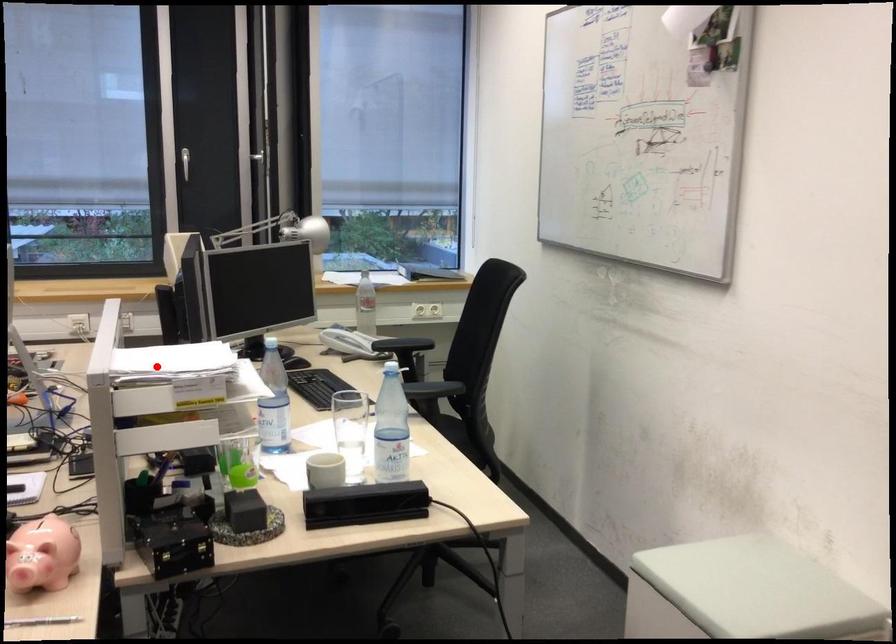
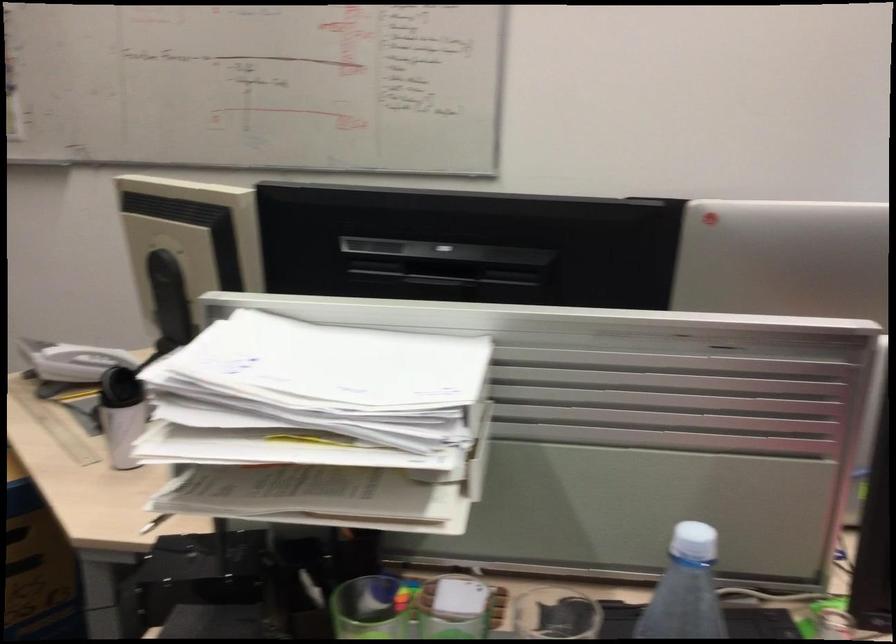
Question: I am providing you with two images of the same scene from different viewpoints. Image1 has a red point marked. In image2, the corresponding 3D location appears at what relative position? Reply with the corresponding letter.

Choices:
 (A) Closer
 (B) Farther

Answer: (A)